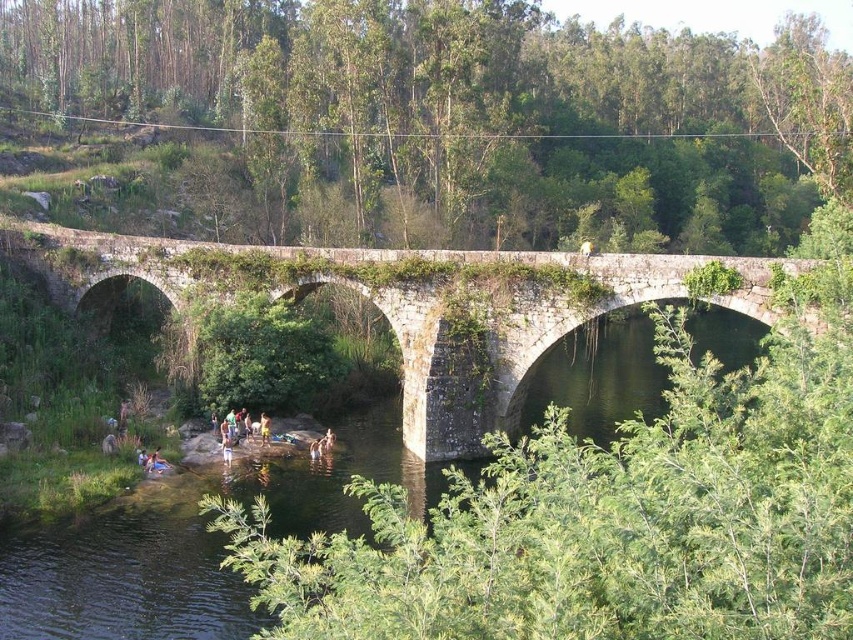
You are a hiker who wants to cross the river using a stick for support. You see the light brown wooden stick at lower center and the yellow fabric shorts at lower center. Which object is wider and can provide better support for your weight?

The light brown wooden stick at lower center is wider than the yellow fabric shorts at lower center, so it can provide better support for your weight.

You are standing at the edge of the river and see the light brown wooden stick at lower center and the yellow fabric shorts at lower center. Which object is nearer to you?

The light brown wooden stick at lower center is closer to the viewer than the yellow fabric shorts at lower center.